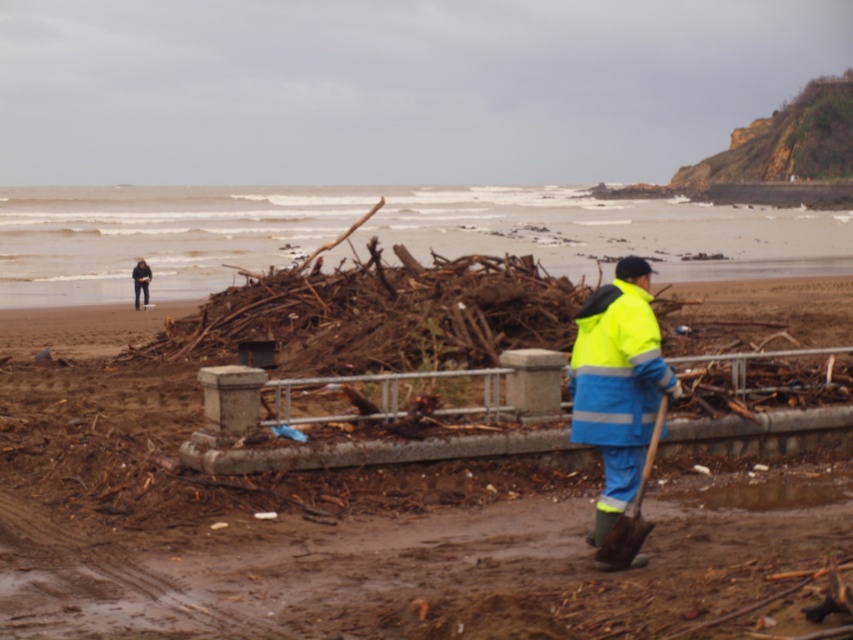
Does matte brown driftwood at center appear over neon yellow fabric shovel at center?

No.

Does point (683, 620) come farther from viewer compared to point (581, 358)?

No, (683, 620) is in front of (581, 358).

What do you see at coordinates (378, 524) in the screenshot?
I see `matte brown driftwood at center` at bounding box center [378, 524].

Locate an element on the screen. The image size is (853, 640). matte brown driftwood at center is located at coordinates (378, 524).

Does neon yellow fabric shovel at center appear on the right side of wooden shovel at lower right?

In fact, neon yellow fabric shovel at center is to the left of wooden shovel at lower right.

Where is `neon yellow fabric shovel at center`? neon yellow fabric shovel at center is located at coordinates (618, 387).

Which is more to the right, neon yellow fabric shovel at center or dark clothing figure at far left?

neon yellow fabric shovel at center is more to the right.

Which is more to the left, neon yellow fabric shovel at center or dark clothing figure at far left?

dark clothing figure at far left

Is point (604, 342) behind point (144, 292)?

No, (604, 342) is closer to viewer.

Identify the location of neon yellow fabric shovel at center. The width and height of the screenshot is (853, 640). (618, 387).